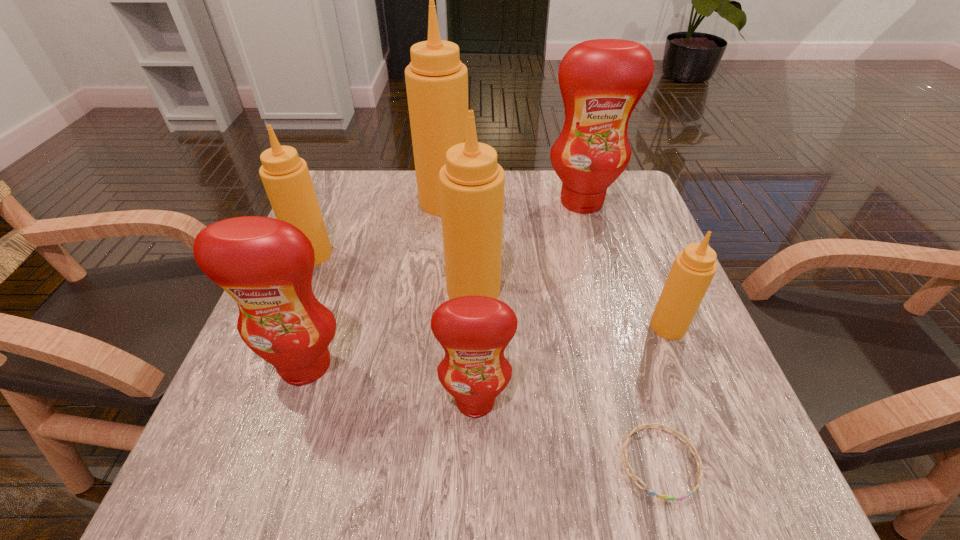
Select which object is the second closest to the smallest red condiment. Please provide its 2D coordinates. Your answer should be formatted as a tuple, i.e. [(x, y)], where the tuple contains the x and y coordinates of a point satisfying the conditions above.

[(471, 183)]

Locate which object is the closest to the third farthest condiment. Please provide its 2D coordinates. Your answer should be formatted as a tuple, i.e. [(x, y)], where the tuple contains the x and y coordinates of a point satisfying the conditions above.

[(436, 80)]

Locate an element on the screen. This screenshot has height=540, width=960. condiment that stands as the sixth closest to the blue bracelet is located at coordinates (436, 80).

Point out which condiment is positioned as the sixth nearest to the third farthest condiment. Please provide its 2D coordinates. Your answer should be formatted as a tuple, i.e. [(x, y)], where the tuple contains the x and y coordinates of a point satisfying the conditions above.

[(693, 269)]

Find the location of a particular element. The height and width of the screenshot is (540, 960). tan condiment that can be found as the third closest to the tallest condiment is located at coordinates (693, 269).

This screenshot has width=960, height=540. Identify the location of tan condiment that stands as the third closest to the tallest object. (693, 269).

Find the location of a particular element. This screenshot has height=540, width=960. the closest red condiment to the second biggest red condiment is located at coordinates (474, 331).

The width and height of the screenshot is (960, 540). I want to click on the third closest red condiment to the rightmost tan condiment, so click(266, 265).

This screenshot has width=960, height=540. I want to click on vacant space that satisfies the following two spatial constraints: 1. on the label side of the smallest tan condiment; 2. on the right side of the farthest red condiment, so click(x=617, y=326).

Locate an element on the screen. The height and width of the screenshot is (540, 960). vacant space that satisfies the following two spatial constraints: 1. on the front side of the farthest tan condiment; 2. on the right side of the fourth nearest condiment is located at coordinates (436, 291).